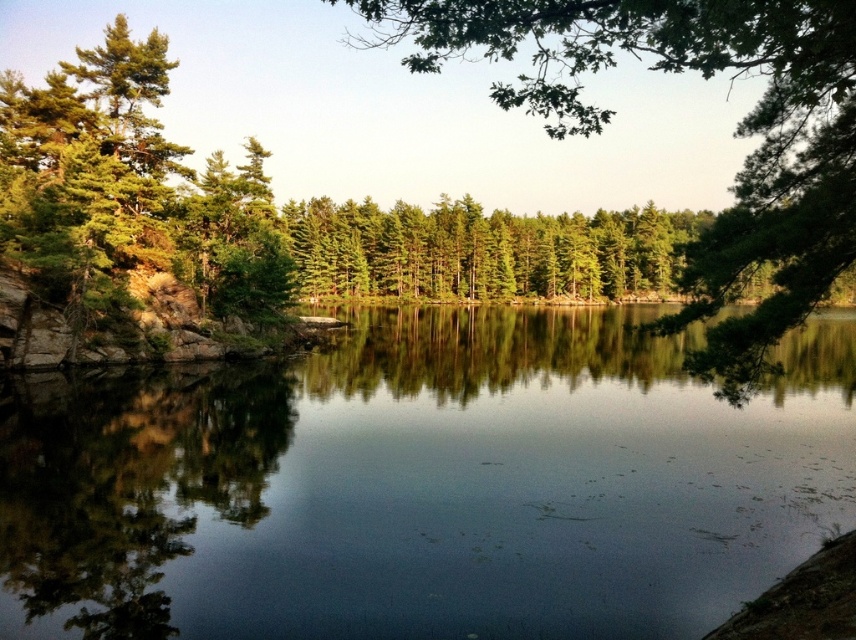
You are a photographer trying to capture the reflection of the green matte tree at upper center in the clear water at center. Will the tree be visible in the reflection?

The green matte tree at upper center is behind the clear water at center, so its reflection would be visible in the clear water at center since the water is calm and reflective.

You are a photographer planning to capture a reflection shot of the clear water at center and the green matte trees at center. Given that your camera can focus on objects up to 200 feet away, will you be able to achieve a sharp reflection of both subjects in a single shot?

The distance between the clear water at center and green matte trees at center is 186.75 feet, which is within the camera focus range of 200 feet. Therefore, you can capture both subjects sharply in one shot.

You want to place a small boat exactly in the middle of the clear water at center. However, you need to ensure it won the green matte tree at upper center won

The clear water at center is narrower than the green matte tree at upper center, so the boat placed in the center of the clear water at center will not extend beyond the green matte tree at upper center.